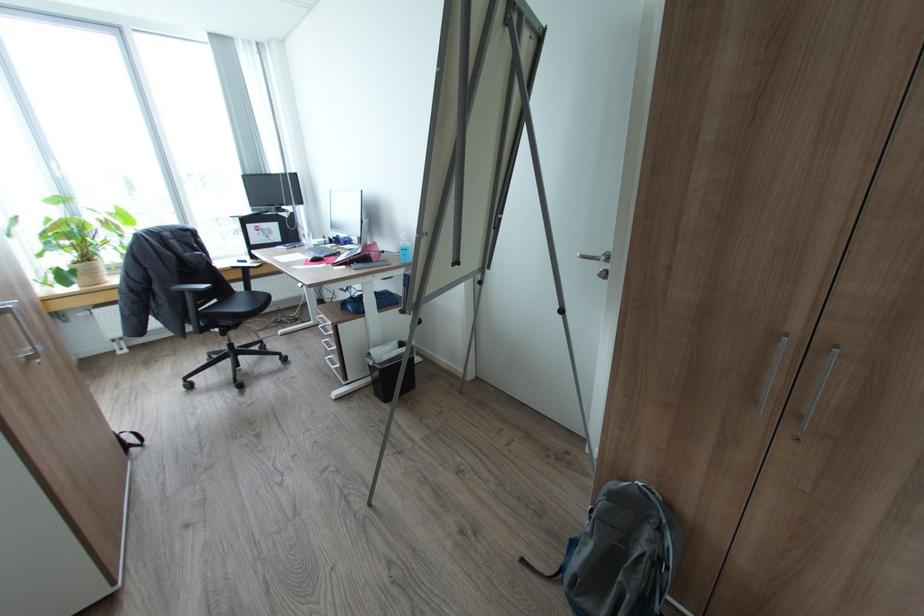
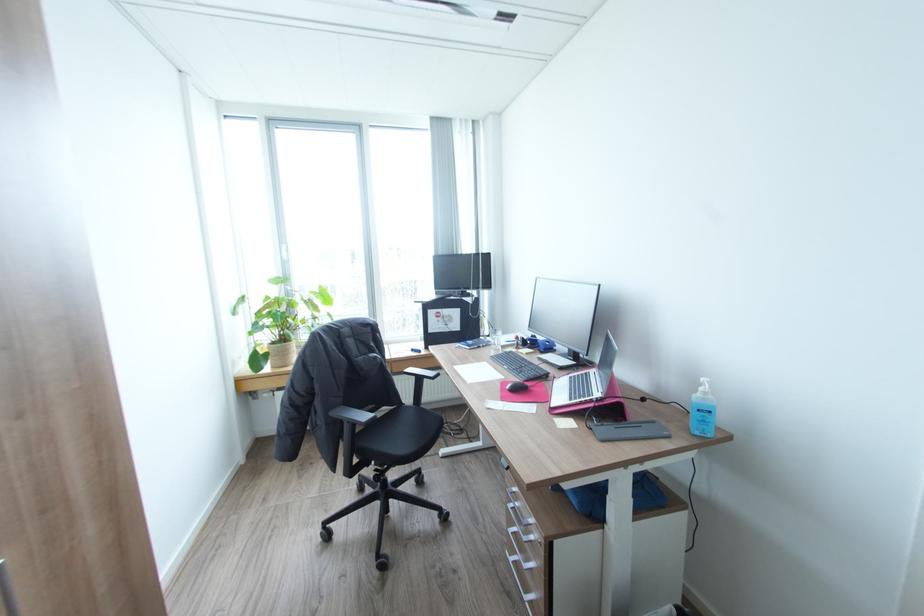
Locate, in the second image, the point that corresponds to point (334, 334) in the first image.

(536, 541)